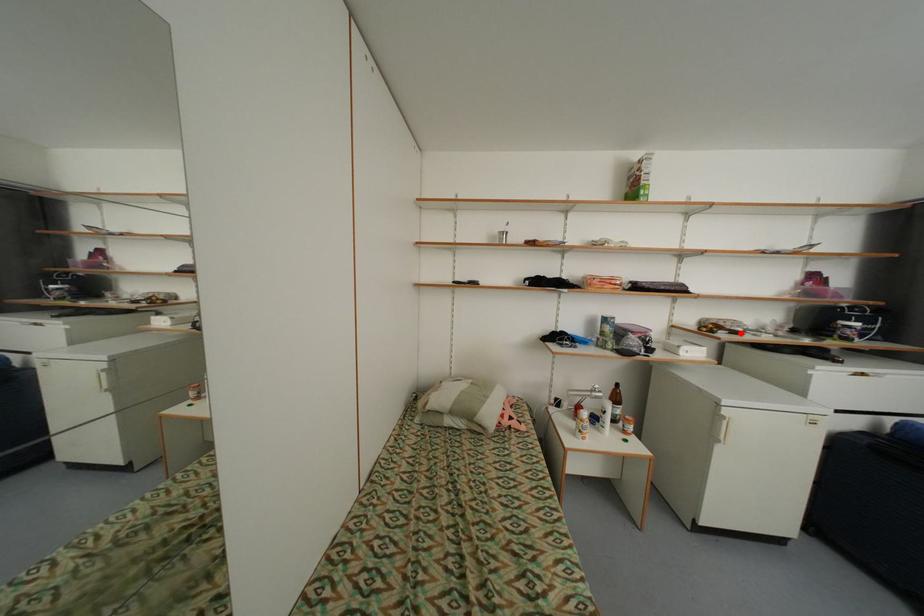
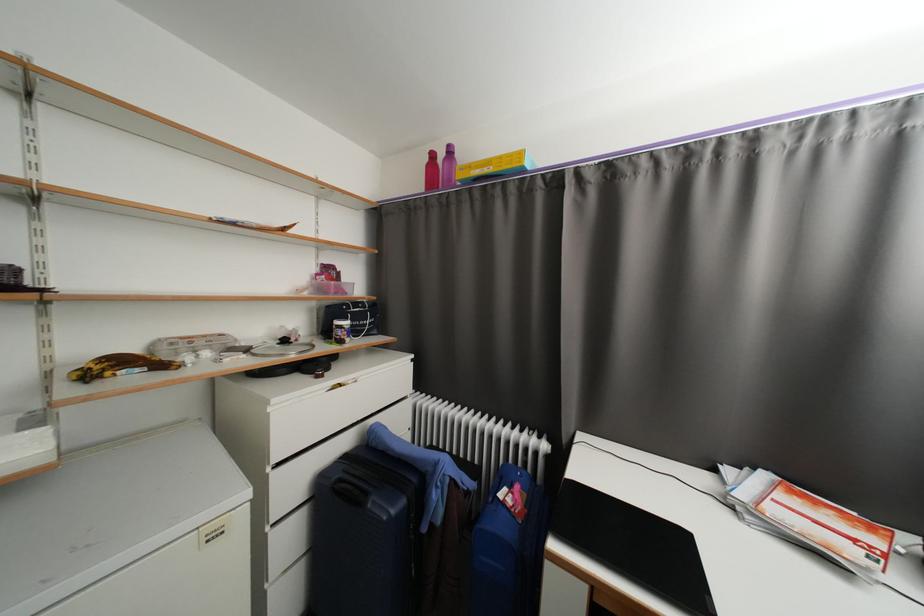
The point at the highlighted location is marked in the first image. Where is the corresponding point in the second image?

(167, 367)